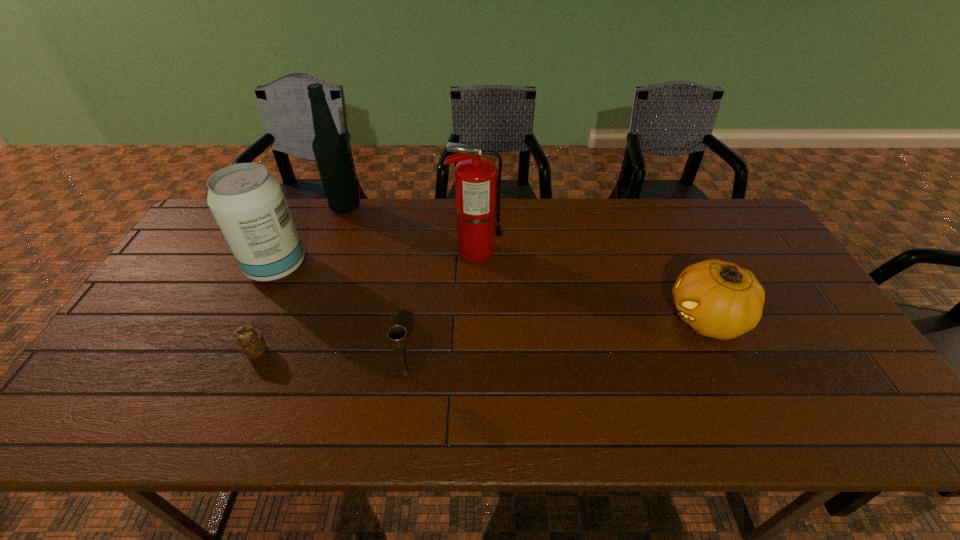
Image resolution: width=960 pixels, height=540 pixels. Find the location of `fire extinguisher positioned at the far edge`. fire extinguisher positioned at the far edge is located at coordinates click(477, 189).

In order to click on blank area at the far edge in this screenshot , I will do `click(532, 215)`.

The height and width of the screenshot is (540, 960). In the image, there is a desktop. Identify the location of vacant region at the near edge. (767, 407).

Locate an element on the screen. This screenshot has width=960, height=540. vacant space at the left edge of the desktop is located at coordinates (120, 354).

This screenshot has height=540, width=960. Find the location of `free point at the right edge`. free point at the right edge is located at coordinates (758, 266).

In order to click on free space between the left alcohol and the right alcohol in this screenshot , I will do `click(311, 237)`.

Where is `vacant space in between the taller alcohol and the shortest object`? This screenshot has height=540, width=960. vacant space in between the taller alcohol and the shortest object is located at coordinates (300, 279).

Identify the location of vacant area between the farther alcohol and the fire extinguisher. This screenshot has width=960, height=540. (411, 229).

I want to click on free space between the fire extinguisher and the right alcohol, so click(411, 229).

You are a GUI agent. You are given a task and a screenshot of the screen. Output one action in this format:
    pyautogui.click(x=<x>, y=<y>)
    Task: Click on the free point between the left alcohol and the shortest object
    
    Given the screenshot: What is the action you would take?
    pyautogui.click(x=266, y=309)